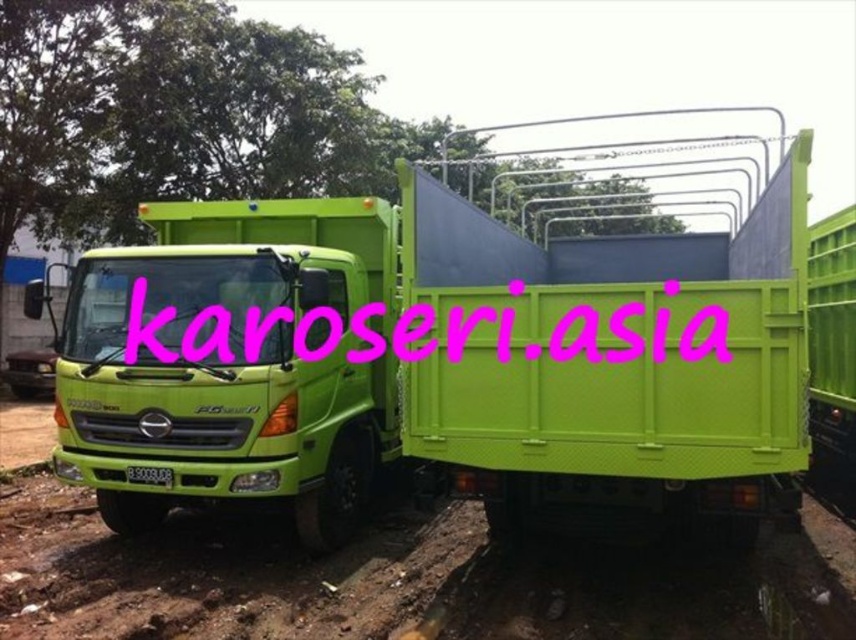
Between point (816, 528) and point (129, 353), which one is positioned in front?

Positioned in front is point (129, 353).

Does green matte dirt track at lower left have a larger size compared to pink text at center?

Correct, green matte dirt track at lower left is larger in size than pink text at center.

Does point (591, 570) come in front of point (125, 346)?

No, it is not.

Locate an element on the screen. green matte dirt track at lower left is located at coordinates (395, 582).

Is lime green plastic truck at center above pink text at center?

Indeed, lime green plastic truck at center is positioned over pink text at center.

Identify the location of lime green plastic truck at center. (438, 362).

Is lime green plastic truck at center taller than green matte dirt track at lower left?

Indeed, lime green plastic truck at center has a greater height compared to green matte dirt track at lower left.

The width and height of the screenshot is (856, 640). Describe the element at coordinates (438, 362) in the screenshot. I see `lime green plastic truck at center` at that location.

Identify the location of lime green plastic truck at center. The image size is (856, 640). (438, 362).